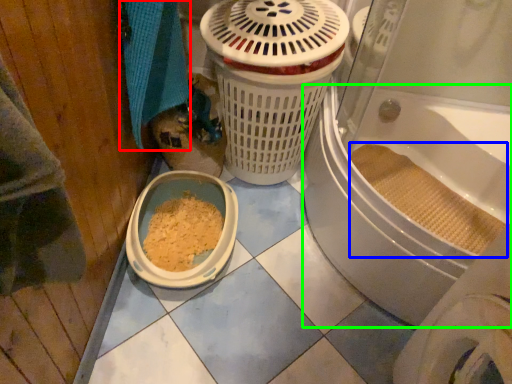
Question: Based on their relative distances, which object is farther from bath towel (highlighted by a red box)? Choose from debris (highlighted by a blue box) and bath (highlighted by a green box).

Choices:
 (A) debris
 (B) bath

Answer: (A)